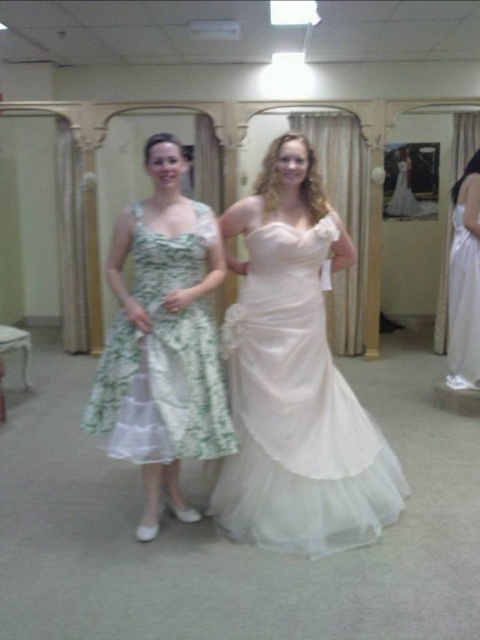
Question: Is satin white dress at center thinner than white satin dress at right?

Choices:
 (A) yes
 (B) no

Answer: (B)

Question: In this image, where is green floral fabric dress at center located relative to white satin dress at right?

Choices:
 (A) above
 (B) below

Answer: (B)

Question: Which point is closer to the camera taking this photo?

Choices:
 (A) (105, 385)
 (B) (256, 312)

Answer: (A)

Question: Which of the following is the closest to the observer?

Choices:
 (A) (300, 477)
 (B) (464, 289)

Answer: (A)

Question: Is satin white dress at center above green floral fabric dress at center?

Choices:
 (A) yes
 (B) no

Answer: (B)

Question: Based on their relative distances, which object is nearer to the green floral fabric dress at center?

Choices:
 (A) white satin dress at right
 (B) satin white dress at center

Answer: (B)